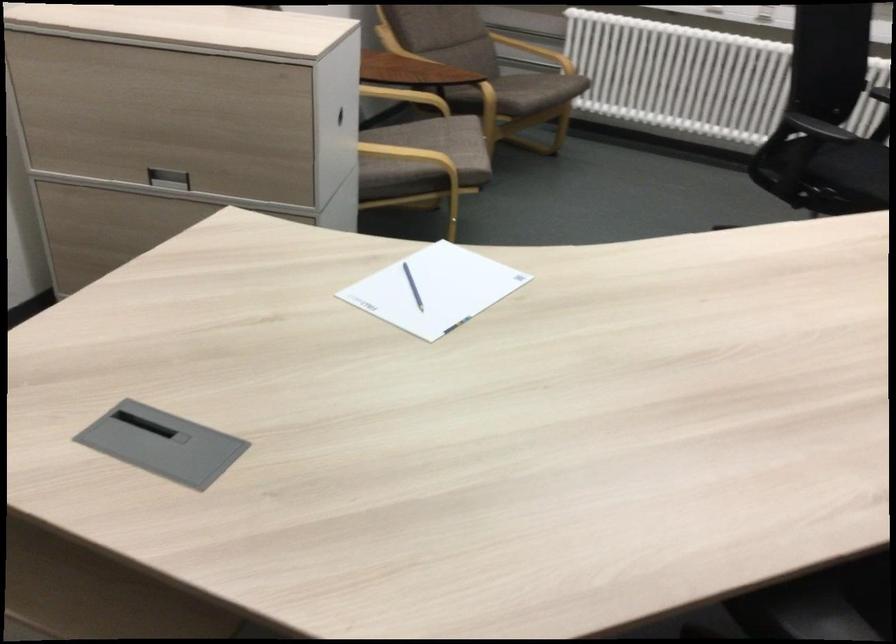
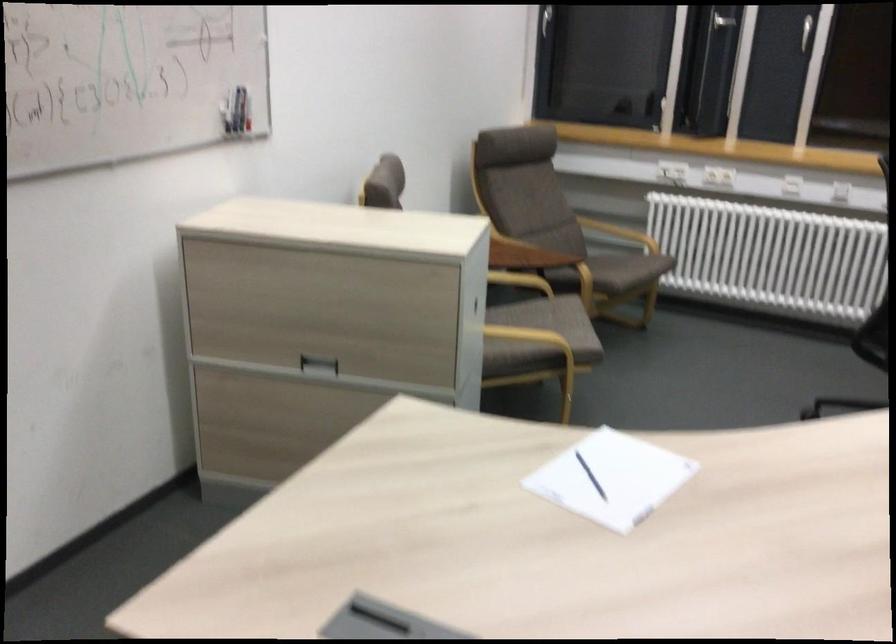
In the second image, find the point that corresponds to (411,100) in the first image.

(520, 279)